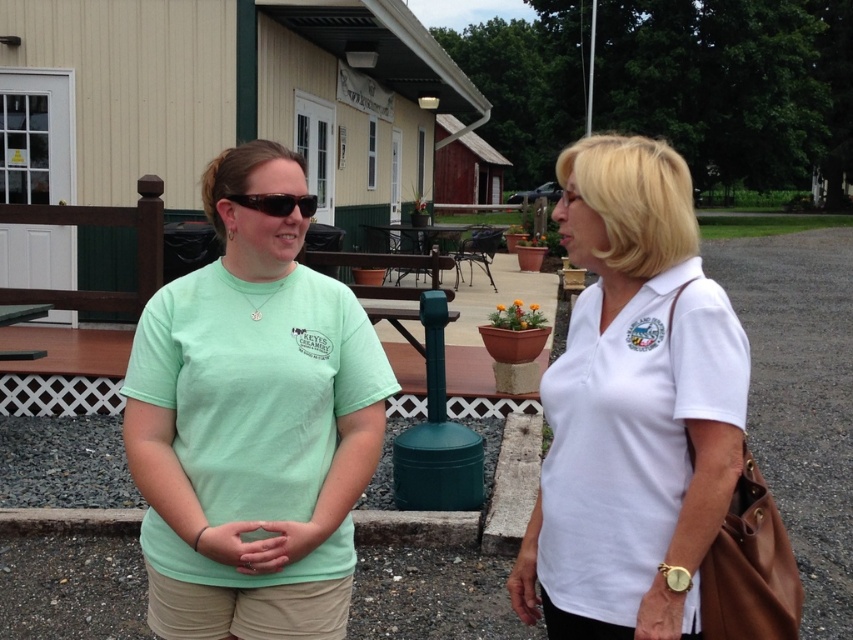
Can you confirm if mint green t-shirt at center is positioned below white matte shirt at center?

Actually, mint green t-shirt at center is above white matte shirt at center.

Which is behind, point (161, 445) or point (717, 490)?

The point (161, 445) is more distant.

At what (x,y) coordinates should I click in order to perform the action: click on mint green t-shirt at center. Please return your answer as a coordinate pair (x, y). Looking at the image, I should click on (252, 422).

Is point (717, 336) closer to viewer compared to point (308, 198)?

That is True.

Does white matte shirt at center appear under matte black sunglasses at center?

Yes, white matte shirt at center is below matte black sunglasses at center.

Is point (566, 556) more distant than point (242, 200)?

No, it is in front of (242, 200).

Locate an element on the screen. This screenshot has width=853, height=640. white matte shirt at center is located at coordinates (631, 406).

Is point (296, 224) less distant than point (257, 205)?

No.

Is mint green t-shirt at center shorter than matte black sunglasses at center?

Incorrect, mint green t-shirt at center's height does not fall short of matte black sunglasses at center's.

Is point (344, 604) in front of point (302, 198)?

That is False.

This screenshot has height=640, width=853. What are the coordinates of `mint green t-shirt at center` in the screenshot? It's located at (252, 422).